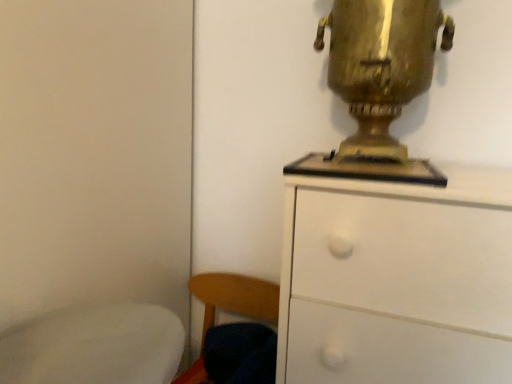
Question: From a real-world perspective, does gold metallic samovar at upper right stand above wooden chair at lower left?

Choices:
 (A) no
 (B) yes

Answer: (B)

Question: Is the position of gold metallic samovar at upper right more distant than that of wooden chair at lower left?

Choices:
 (A) no
 (B) yes

Answer: (A)

Question: Does gold metallic samovar at upper right lie in front of wooden chair at lower left?

Choices:
 (A) no
 (B) yes

Answer: (B)

Question: Is gold metallic samovar at upper right beside wooden chair at lower left?

Choices:
 (A) no
 (B) yes

Answer: (A)

Question: Considering the relative sizes of gold metallic samovar at upper right and wooden chair at lower left in the image provided, is gold metallic samovar at upper right shorter than wooden chair at lower left?

Choices:
 (A) no
 (B) yes

Answer: (A)

Question: Considering the relative positions of gold metallic samovar at upper right and wooden chair at lower left in the image provided, is gold metallic samovar at upper right to the right of wooden chair at lower left from the viewer's perspective?

Choices:
 (A) no
 (B) yes

Answer: (B)

Question: Is gold metallic samovar at upper right placed right next to white matte chest of drawers at upper right?

Choices:
 (A) no
 (B) yes

Answer: (A)

Question: From a real-world perspective, is gold metallic samovar at upper right on white matte chest of drawers at upper right?

Choices:
 (A) no
 (B) yes

Answer: (B)

Question: Considering the relative positions of gold metallic samovar at upper right and white matte chest of drawers at upper right in the image provided, is gold metallic samovar at upper right to the right of white matte chest of drawers at upper right from the viewer's perspective?

Choices:
 (A) yes
 (B) no

Answer: (B)

Question: Is gold metallic samovar at upper right far away from white matte chest of drawers at upper right?

Choices:
 (A) no
 (B) yes

Answer: (A)

Question: From the image's perspective, is gold metallic samovar at upper right located above white matte chest of drawers at upper right?

Choices:
 (A) yes
 (B) no

Answer: (A)

Question: Does gold metallic samovar at upper right have a larger size compared to white matte chest of drawers at upper right?

Choices:
 (A) no
 (B) yes

Answer: (A)

Question: From the image's perspective, is wooden chair at lower left under white matte chest of drawers at upper right?

Choices:
 (A) no
 (B) yes

Answer: (B)